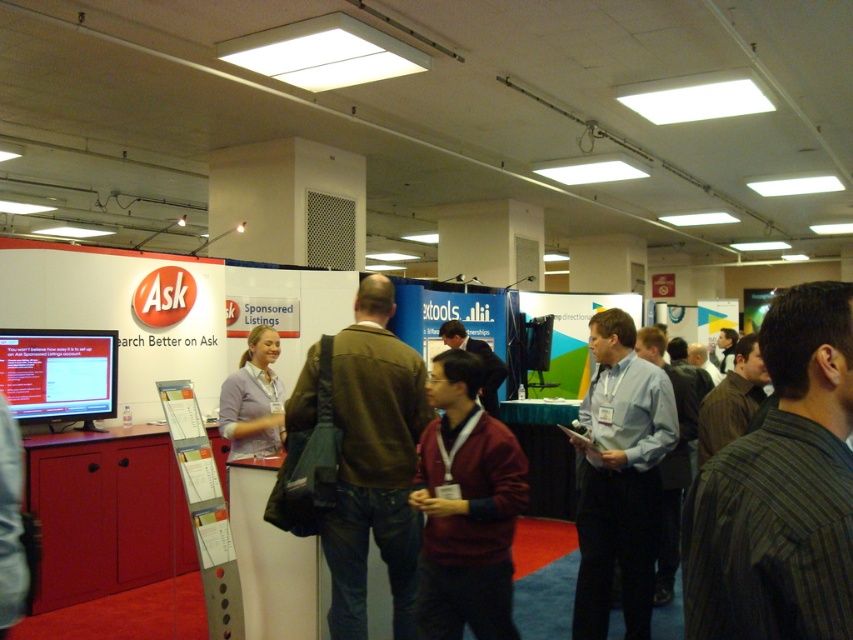
Question: Which point is farther from the camera taking this photo?

Choices:
 (A) (647, 388)
 (B) (268, 401)
 (C) (834, 499)

Answer: (B)

Question: Is matte black monitor at left behind brown striped shirt at right?

Choices:
 (A) no
 (B) yes

Answer: (B)

Question: Which object is farther from the camera taking this photo?

Choices:
 (A) maroon sweater at center
 (B) brown striped shirt at right
 (C) striped cotton shirt at center
 (D) dark brown leather jacket at center

Answer: (D)

Question: Is striped cotton shirt at center below dark brown leather jacket at center?

Choices:
 (A) no
 (B) yes

Answer: (B)

Question: Which of the following is the farthest from the observer?

Choices:
 (A) (822, 388)
 (B) (753, 340)
 (C) (488, 385)
 (D) (67, 358)

Answer: (C)

Question: Is brown leather jacket at center above light purple shirt at center?

Choices:
 (A) no
 (B) yes

Answer: (A)